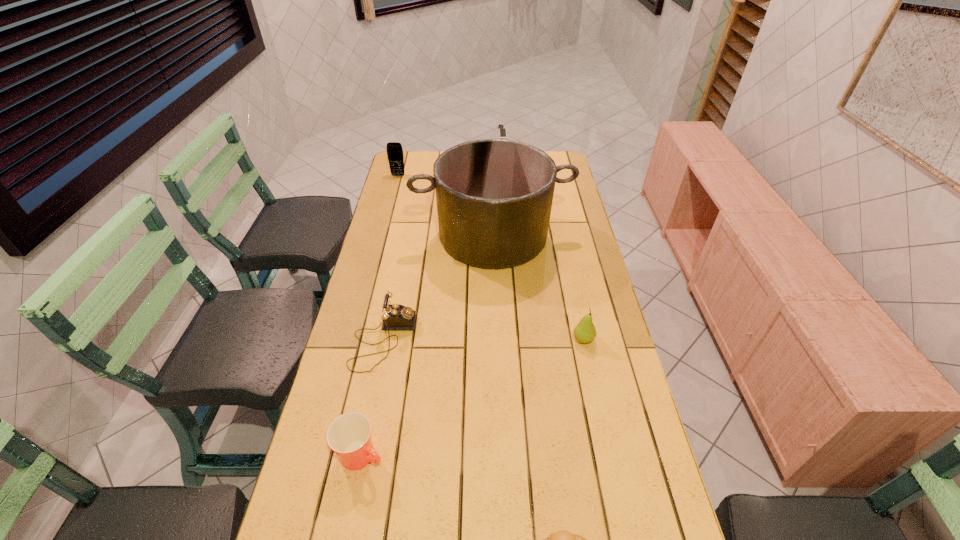
Image resolution: width=960 pixels, height=540 pixels. Find the location of `vacant position located on the left of the pear`. vacant position located on the left of the pear is located at coordinates (545, 339).

Find the location of a particular element. This screenshot has width=960, height=540. free space located on the back of the second nearest object is located at coordinates (373, 399).

The image size is (960, 540). I want to click on vacant area situated on the dial of the telephone, so click(x=486, y=340).

Where is `camcorder present at the far edge`? The image size is (960, 540). camcorder present at the far edge is located at coordinates (502, 131).

I want to click on cellular telephone situated at the far edge, so click(395, 156).

Where is `pan that is at the left edge`? The width and height of the screenshot is (960, 540). pan that is at the left edge is located at coordinates (494, 197).

Locate an element on the screen. cellular telephone at the left edge is located at coordinates (395, 156).

At what (x,y) coordinates should I click in order to perform the action: click on cup that is at the left edge. Please return your answer as a coordinate pair (x, y). The image size is (960, 540). Looking at the image, I should click on 349,435.

Where is `telephone that is at the left edge`? The height and width of the screenshot is (540, 960). telephone that is at the left edge is located at coordinates (395, 317).

This screenshot has height=540, width=960. In order to click on pan situated at the right edge in this screenshot , I will do (494, 197).